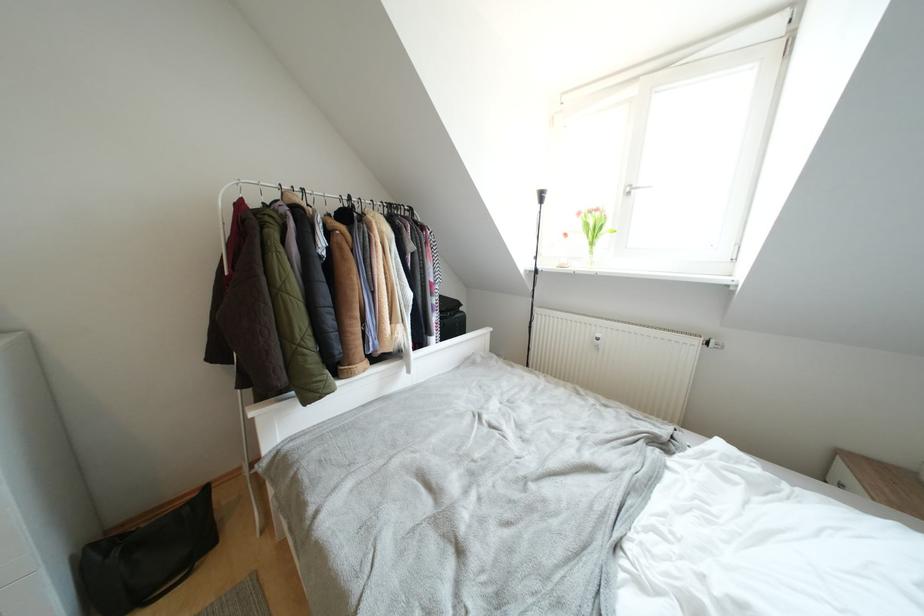
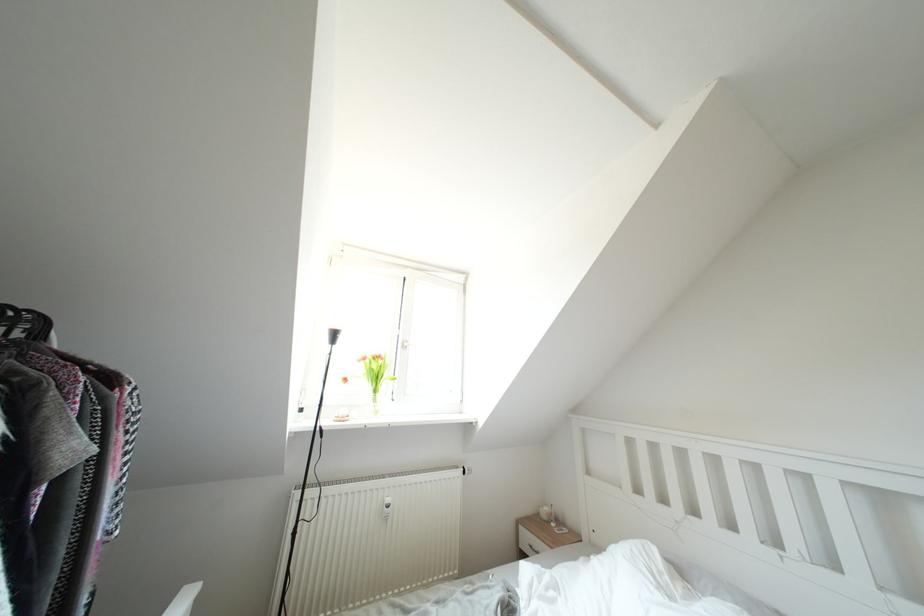
Based on the continuous images, in which direction is the camera rotating?

The rotation direction of the camera is right-up.